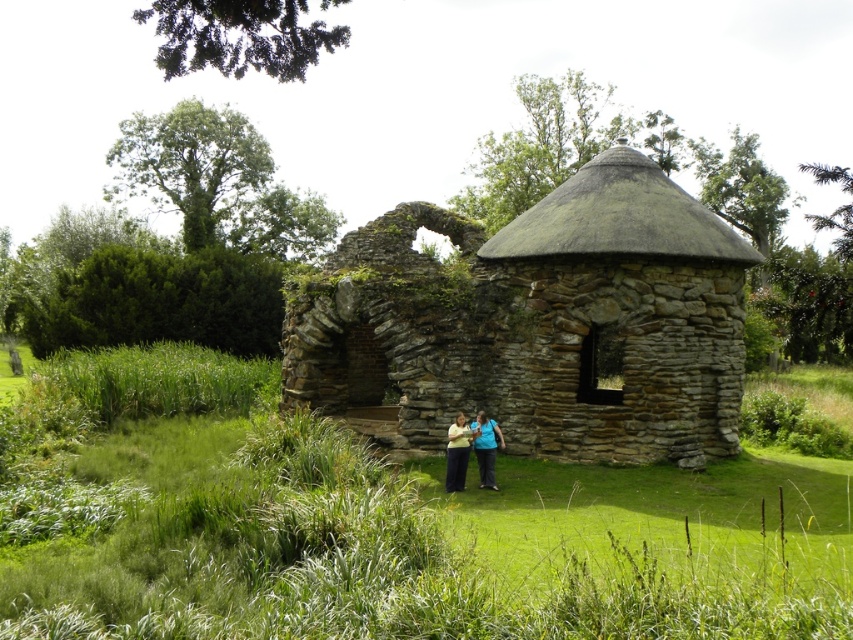
Is blue denim jeans at center bigger than dark blue fabric at center?

Correct, blue denim jeans at center is larger in size than dark blue fabric at center.

Measure the distance from blue denim jeans at center to dark blue fabric at center.

They are 12.96 inches apart.

Locate an element on the screen. The width and height of the screenshot is (853, 640). blue denim jeans at center is located at coordinates (473, 449).

Locate an element on the screen. The height and width of the screenshot is (640, 853). blue denim jeans at center is located at coordinates (473, 449).

Looking at this image, does green grass at center appear under blue denim jeans at center?

No, green grass at center is not below blue denim jeans at center.

In the scene shown: Which is above, green grass at center or blue denim jeans at center?

green grass at center is above.

What do you see at coordinates (378, 524) in the screenshot? I see `green grass at center` at bounding box center [378, 524].

You are a GUI agent. You are given a task and a screenshot of the screen. Output one action in this format:
    pyautogui.click(x=<x>, y=<y>)
    Task: Click on the green grass at center
    The image size is (853, 640).
    Given the screenshot: What is the action you would take?
    pyautogui.click(x=378, y=524)

Between rustic stone ruins at center and blue denim jeans at center, which one is positioned lower?

blue denim jeans at center is below.

Can you confirm if rustic stone ruins at center is positioned to the left of blue denim jeans at center?

Incorrect, rustic stone ruins at center is not on the left side of blue denim jeans at center.

Which is in front, point (518, 321) or point (467, 444)?

Point (467, 444) is more forward.

Where is `rustic stone ruins at center`? rustic stone ruins at center is located at coordinates (537, 323).